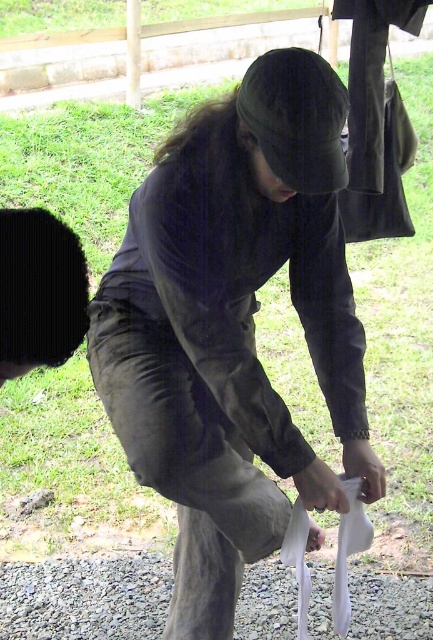
You are standing at the center of the image and want to place a small item exactly at the center. Is the dark gray fabric at center already occupying that spot?

The dark gray fabric at center is located at point (x=232, y=326), which is very close to the center coordinates of the image. Therefore, placing the item at the exact center might overlap slightly with the dark gray fabric at center.

You are a hiker who needs to cross a path. You see the dark gray fabric at center and the gray gravel at lower center. Which one is located to the right side of the other?

The dark gray fabric at center is to the right of gray gravel at lower center.

You are standing in the scene and want to place a small marker at the closest point between point (155, 216) and point (155, 621). Which point should you choose?

Point (155, 216) is closer to the viewer than point (155, 621), so you should place the marker at point (155, 216).